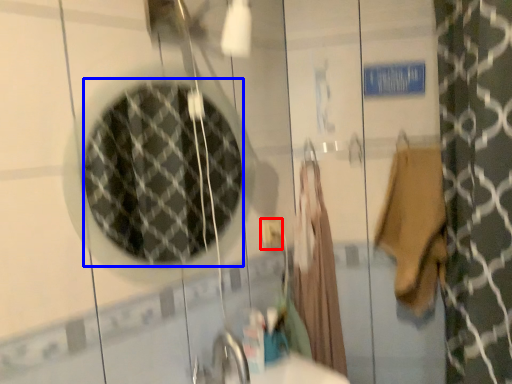
Question: Which object is closer to the camera taking this photo, electric outlet (highlighted by a red box) or mirror (highlighted by a blue box)?

Choices:
 (A) electric outlet
 (B) mirror

Answer: (B)